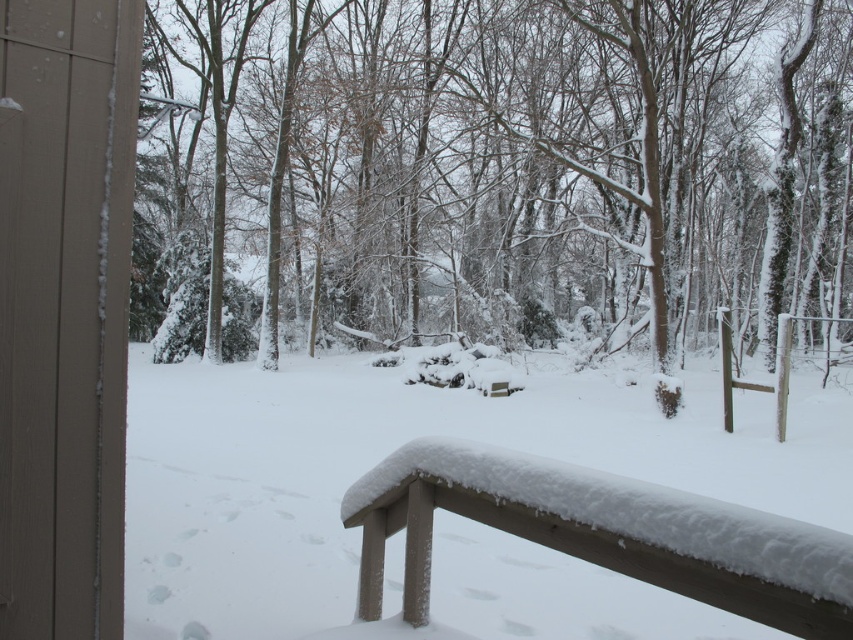
Is snow-covered tree at center taller than white fluffy snow at center?

Indeed, snow-covered tree at center has a greater height compared to white fluffy snow at center.

Does point (277, 156) lie in front of point (132, 371)?

Yes, it is in front of point (132, 371).

Where is `snow-covered tree at center`? Image resolution: width=853 pixels, height=640 pixels. snow-covered tree at center is located at coordinates (509, 157).

From the picture: Which of these two, snow-covered tree at center or snow-covered wood bench at lower center, stands taller?

snow-covered tree at center

Can you confirm if snow-covered tree at center is wider than snow-covered wood bench at lower center?

Yes, snow-covered tree at center is wider than snow-covered wood bench at lower center.

Who is more distant from viewer, [509,99] or [355,486]?

Point [509,99]

Find the location of a particular element. snow-covered tree at center is located at coordinates (509, 157).

Is the position of white fluffy snow at center less distant than that of snow-covered wood bench at lower center?

No, it is not.

Between white fluffy snow at center and snow-covered wood bench at lower center, which one has less height?

snow-covered wood bench at lower center is shorter.

I want to click on white fluffy snow at center, so click(x=436, y=504).